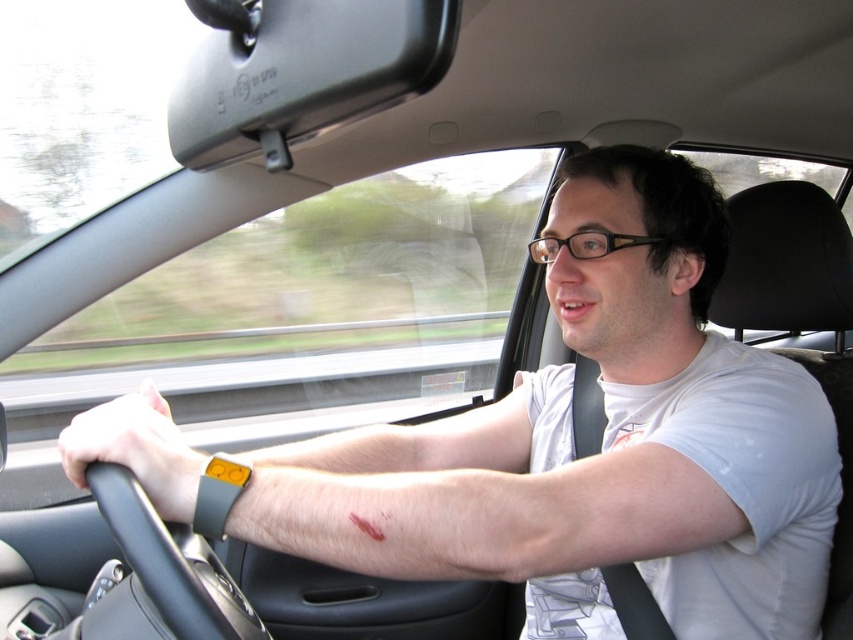
At what (x,y) coordinates should I click in order to perform the action: click on light skin/soft hair at center. Please return your answer as a coordinate pair (x, y). The width and height of the screenshot is (853, 640). Looking at the image, I should click on (476, 500).

Which is behind, point (91, 417) or point (357, 529)?

The point (91, 417) is behind.

You are a GUI agent. You are given a task and a screenshot of the screen. Output one action in this format:
    pyautogui.click(x=<x>, y=<y>)
    Task: Click on the light skin/soft hair at center
    
    Given the screenshot: What is the action you would take?
    pyautogui.click(x=476, y=500)

Is light skin/soft hair at center to the right of black rubber steering wheel at center from the viewer's perspective?

Yes, light skin/soft hair at center is to the right of black rubber steering wheel at center.

Is point (161, 410) positioned behind point (172, 593)?

That is True.

Does point (666, 488) come in front of point (100, 605)?

Yes, point (666, 488) is in front of point (100, 605).

The height and width of the screenshot is (640, 853). Identify the location of light skin/soft hair at center. (476, 500).

Is point (183, 572) positioned in front of point (367, 529)?

No, it is behind (367, 529).

Is black rubber steering wheel at center in front of blood at arm lower right?

Yes, it is in front of blood at arm lower right.

Does point (102, 481) come in front of point (357, 518)?

Yes, it is in front of point (357, 518).

Image resolution: width=853 pixels, height=640 pixels. What are the coordinates of `black rubber steering wheel at center` in the screenshot? It's located at (161, 573).